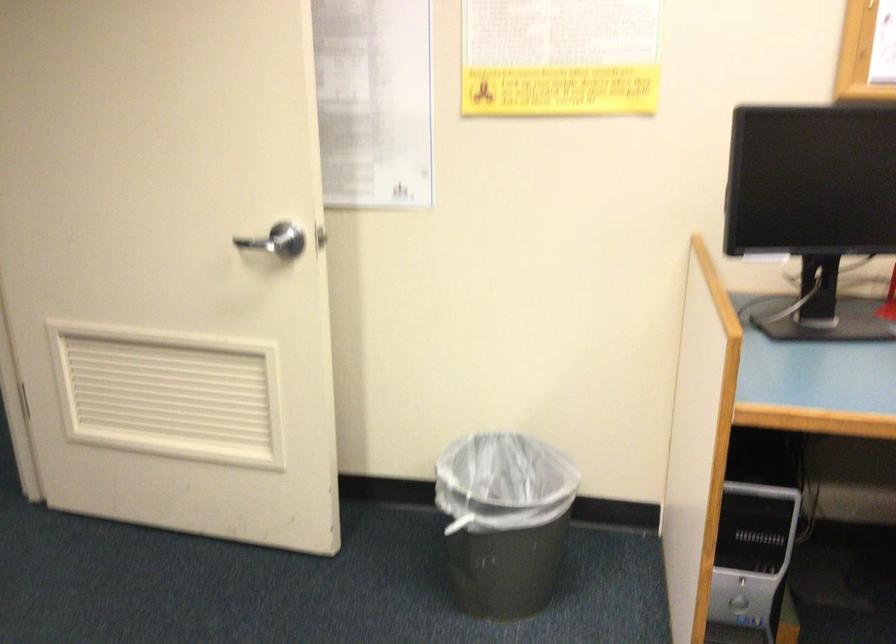
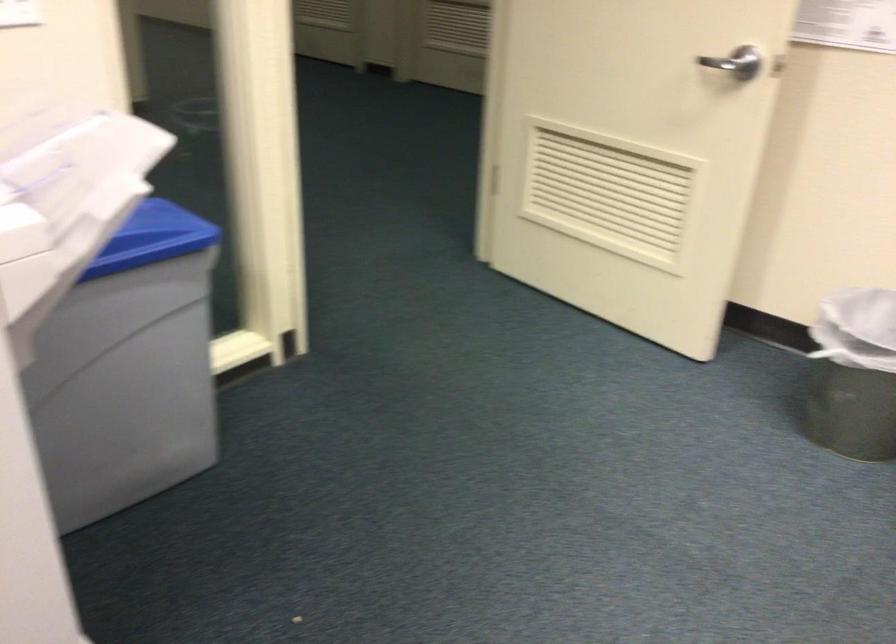
Locate, in the second image, the point that corresponds to the point at 475,538 in the first image.

(854, 375)